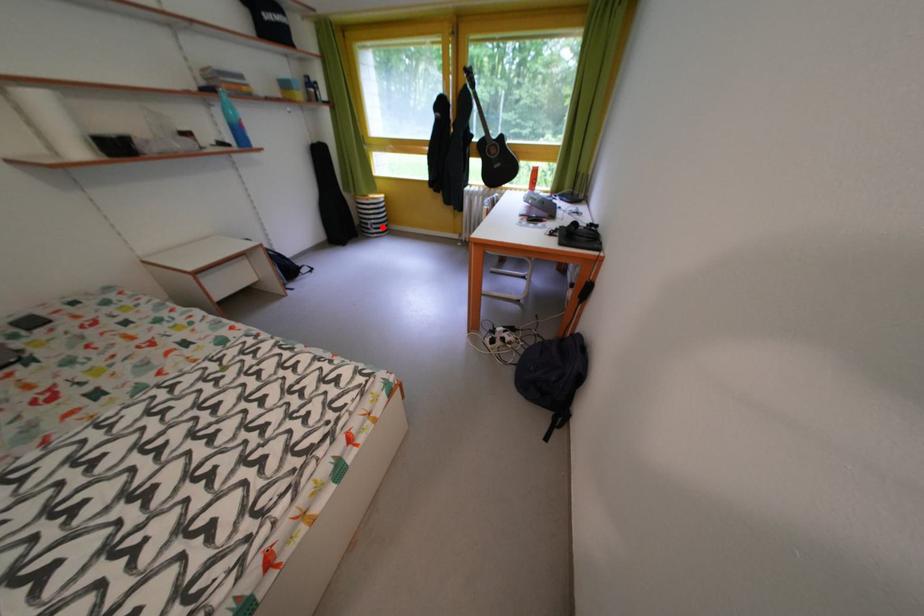
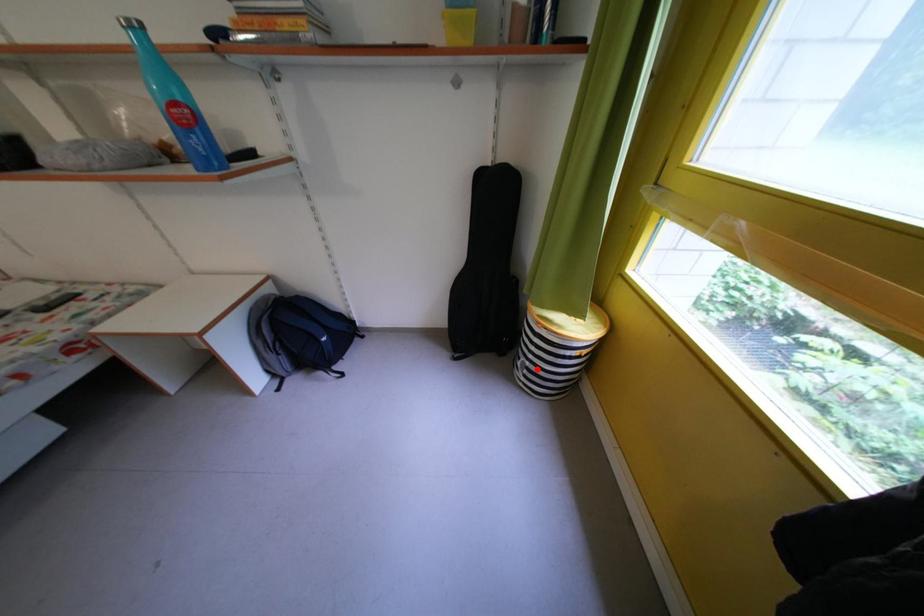
I am providing you with two images of the same scene from different viewpoints. A red point is marked on the first image and another point is marked on the second image. Are the points marked in image1 and image2 representing the same 3D position?

Yes